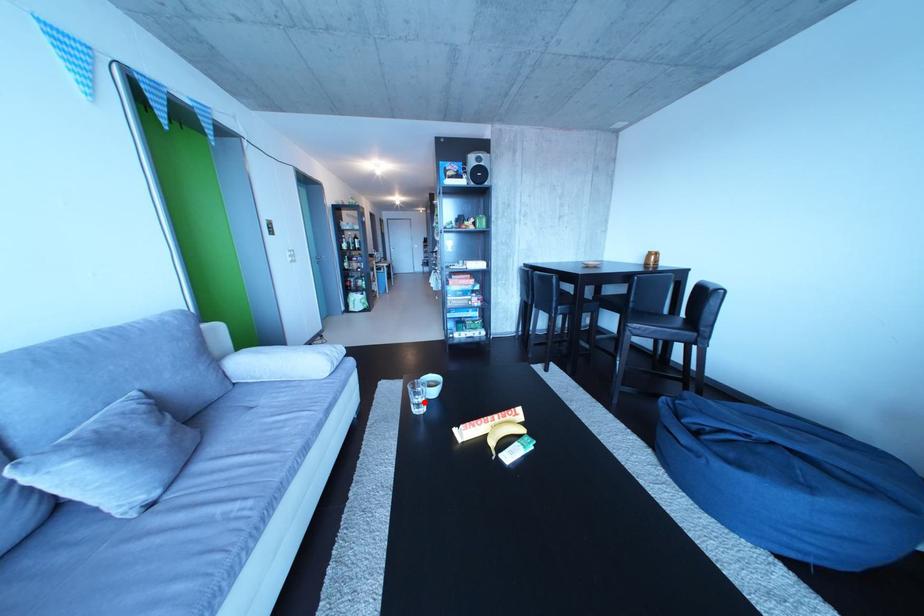
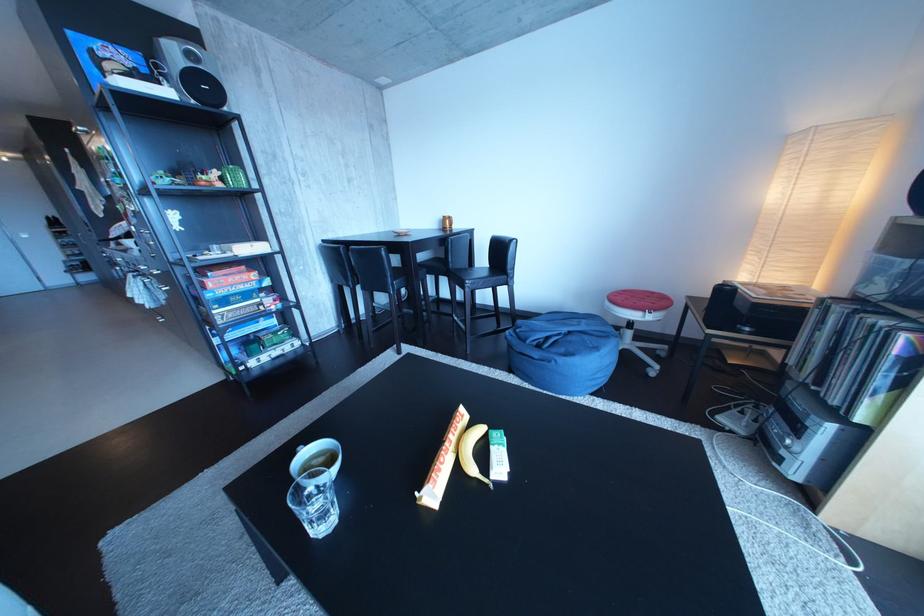
In the second image, find the point that corresponds to the highlighted location in the first image.

(317, 522)